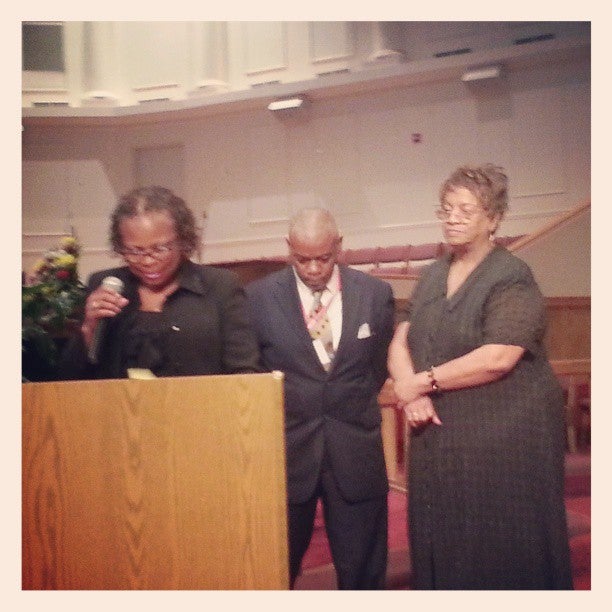
At what (x,y) coordinates should I click in order to perform the action: click on wall. Please return your answer as a coordinate pair (x, y). The height and width of the screenshot is (612, 612). Looking at the image, I should click on (381, 151).